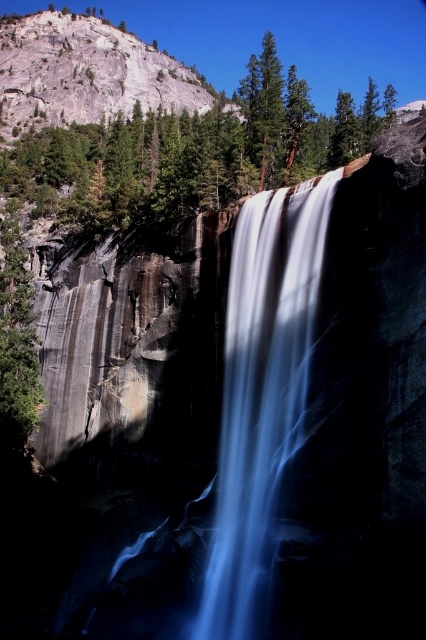
Is point (161, 209) closer to camera compared to point (23, 273)?

Yes, it is.

Can you confirm if green textured tree at center is positioned to the left of green rough bark tree at left?

In fact, green textured tree at center is to the right of green rough bark tree at left.

Which is in front, point (155, 180) or point (3, 304)?

Point (3, 304) is in front.

The height and width of the screenshot is (640, 426). In order to click on green textured tree at center in this screenshot , I will do `click(190, 152)`.

Does point (25, 156) come farther from viewer compared to point (218, 492)?

Yes, it is behind point (218, 492).

Is green textured tree at center to the left of blue translucent water at center from the viewer's perspective?

In fact, green textured tree at center is to the right of blue translucent water at center.

Is point (284, 81) behind point (218, 531)?

Yes, point (284, 81) is farther from viewer.

Locate an element on the screen. green textured tree at center is located at coordinates (190, 152).

Is point (268, 253) positioned after point (16, 346)?

No.

Which is in front, point (250, 380) or point (5, 241)?

Point (250, 380)

Between point (222, 529) and point (16, 301), which one is positioned in front?

Point (222, 529) is in front.

At what (x,y) coordinates should I click in order to perform the action: click on blue translucent water at center. Please return your answer as a coordinate pair (x, y). Looking at the image, I should click on pyautogui.click(x=261, y=390).